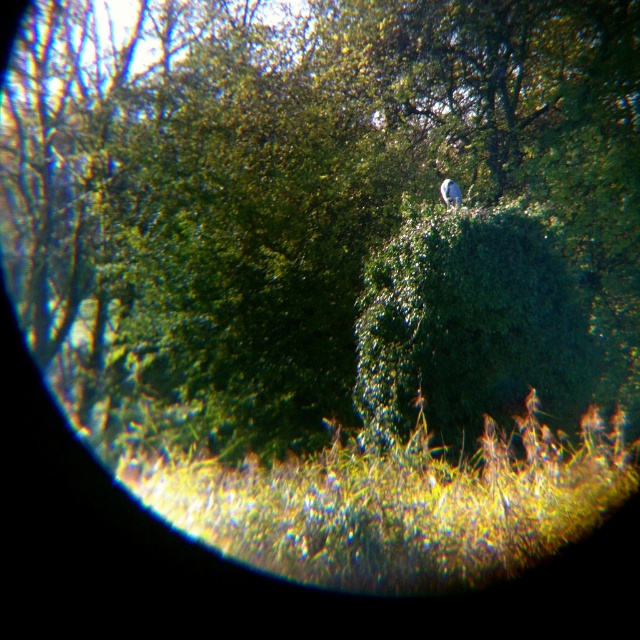
Is green leafy hedge at center shorter than white matte bird at upper center?

In fact, green leafy hedge at center may be taller than white matte bird at upper center.

From the picture: Does green leafy hedge at center have a smaller size compared to white matte bird at upper center?

No, green leafy hedge at center is not smaller than white matte bird at upper center.

Find the location of a particular element. green leafy hedge at center is located at coordinates (468, 324).

This screenshot has width=640, height=640. Identify the location of green leafy hedge at center. (468, 324).

Can you confirm if yellow-green grass at lower center is positioned below green leafy hedge at center?

Indeed, yellow-green grass at lower center is positioned under green leafy hedge at center.

Does yellow-green grass at lower center lie behind green leafy hedge at center?

That is False.

Between point (512, 484) and point (490, 268), which one is positioned behind?

The point (490, 268) is more distant.

The height and width of the screenshot is (640, 640). Find the location of `yellow-green grass at lower center`. yellow-green grass at lower center is located at coordinates (397, 504).

At what (x,y) coordinates should I click in order to perform the action: click on yellow-green grass at lower center. Please return your answer as a coordinate pair (x, y). Looking at the image, I should click on (397, 504).

Measure the distance between yellow-green grass at lower center and camera.

yellow-green grass at lower center is 15.16 feet away from camera.

Identify the location of yellow-green grass at lower center. (397, 504).